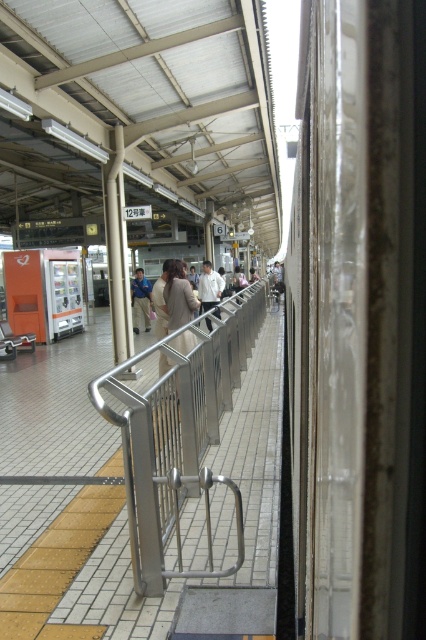
You are standing on the train platform and want to hand a brochure to the person wearing the light brown fabric coat at center and the light beige fabric jacket at center. If you can throw an object 8 meters, will you be able to reach both of them?

The light brown fabric coat at center is 8.87 meters away from the light beige fabric jacket at center. Since your throwing distance is 8 meters, you cannot reach both individuals as the distance between them exceeds your throwing range.

You are a passenger on the train looking out the window. You notice two coats hanging on the platform railing at center. The light brown fabric coat at center and the light beige fabric jacket at center. Which coat is narrower?

The light brown fabric coat at center is narrower than the light beige fabric jacket at center according to the description.

You are a maintenance worker standing at the camera position and need to inspect the silver metallic rail at center. Can you reach it without moving from your current position?

The silver metallic rail at center is 2.95 meters away from the camera, so you cannot reach it without moving from your current position.